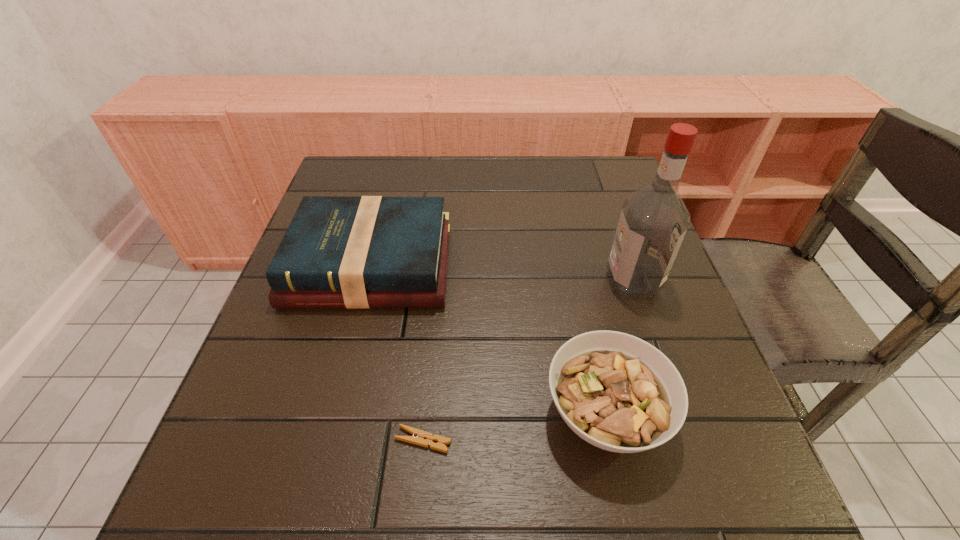
The width and height of the screenshot is (960, 540). I want to click on the tallest object, so click(654, 219).

The width and height of the screenshot is (960, 540). I want to click on hardback book, so click(365, 252).

The image size is (960, 540). What are the coordinates of `stew` in the screenshot? It's located at [x=617, y=392].

Find the location of a particular element. clothespin is located at coordinates (425, 439).

In order to click on vacant space located 0.130m on the front-facing side of the tallest object in this screenshot , I will do `click(548, 281)`.

Locate an element on the screen. The height and width of the screenshot is (540, 960). free space located 0.360m on the front-facing side of the tallest object is located at coordinates (441, 281).

The image size is (960, 540). I want to click on free region located on the front-facing side of the tallest object, so click(543, 281).

This screenshot has height=540, width=960. Identify the location of free region located on the front of the hardback book. (316, 481).

In order to click on free location located on the back of the stew in this screenshot , I will do `click(572, 261)`.

Image resolution: width=960 pixels, height=540 pixels. What are the coordinates of `vacant space situated 0.150m on the back of the shortest object` in the screenshot? It's located at (432, 350).